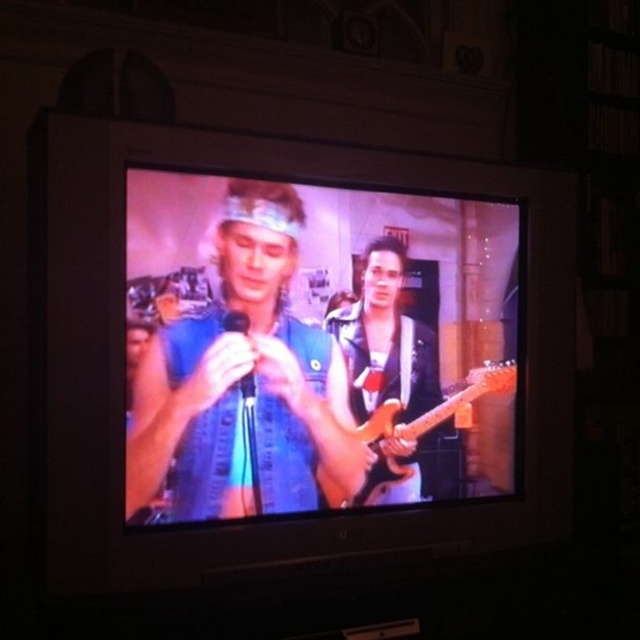
You are a photographer trying to capture a closeup of the blue denim vest at center and the glossy wood guitar at center on the TV screen. Which object should you focus on first if you want to ensure both are in focus without adjusting the camera settings?

The blue denim vest at center is wider than the glossy wood guitar at center, so focusing on the wider object first would help ensure both are in focus.

You are a photographer trying to capture a clear shot of both the blue denim vest at center and the shiny black guitar at center on the TV screen. Since the camera can only focus on one object at a time, which object should you focus on first to ensure it appears larger in the photo?

The blue denim vest at center is taller than the shiny black guitar at center, so focusing on the blue denim vest at center first will ensure it appears larger in the photo.

You are a costume designer trying to fit a costume over the blue denim vest at center and the shiny black guitar at center. Based on their sizes, which object requires a larger space in the costume design?

The blue denim vest at center requires a larger space in the costume design because its width is greater than that of the shiny black guitar at center.